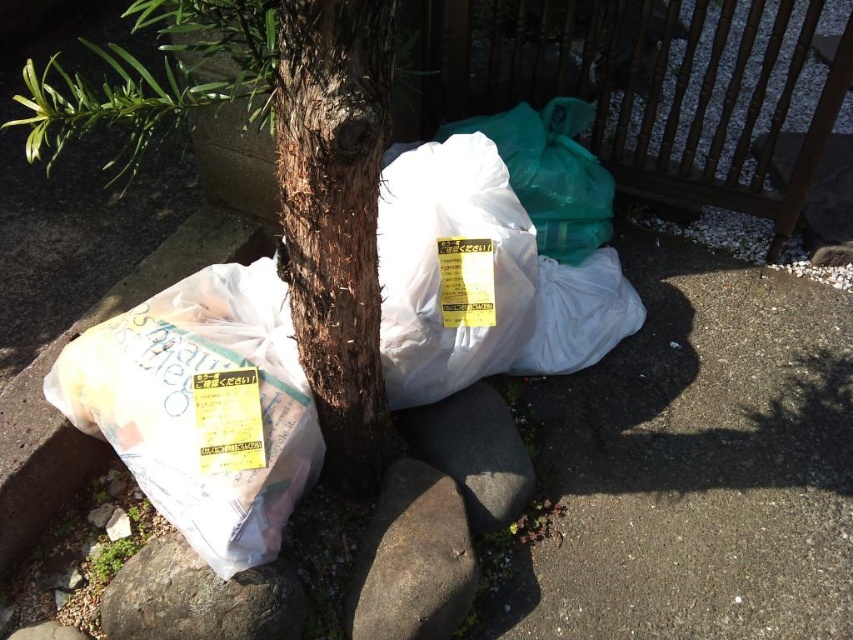
Which is below, brown rough stone at lower center or gray rough stone at lower left?

gray rough stone at lower left is below.

Does brown rough stone at lower center come in front of gray rough stone at lower left?

No.

Locate an element on the screen. Image resolution: width=853 pixels, height=640 pixels. brown rough stone at lower center is located at coordinates (x=412, y=560).

Does white plastic bag at lower left have a greater height compared to gray rough stone at lower left?

Correct, white plastic bag at lower left is much taller as gray rough stone at lower left.

Between white plastic bag at lower left and gray rough stone at lower left, which one has more height?

white plastic bag at lower left

This screenshot has height=640, width=853. What are the coordinates of `white plastic bag at lower left` in the screenshot? It's located at (279, 170).

Image resolution: width=853 pixels, height=640 pixels. Identify the location of white plastic bag at lower left. (279, 170).

Is white plastic bag at left taller than gray rough stone at lower left?

Indeed, white plastic bag at left has a greater height compared to gray rough stone at lower left.

Does white plastic bag at left have a lesser width compared to gray rough stone at lower left?

Incorrect, white plastic bag at left's width is not less than gray rough stone at lower left's.

Which is behind, point (126, 362) or point (196, 628)?

The point (126, 362) is behind.

The height and width of the screenshot is (640, 853). I want to click on white plastic bag at left, so click(x=193, y=403).